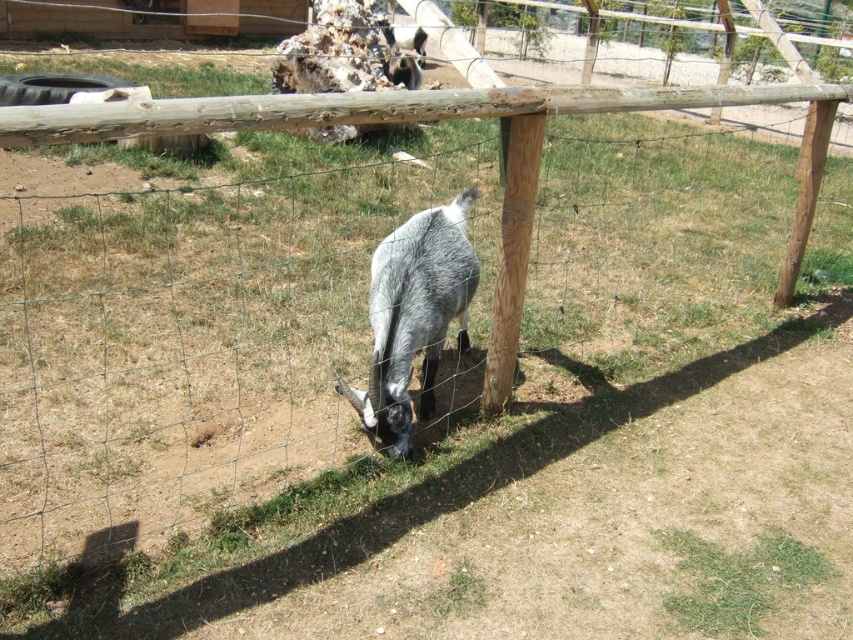
Based on the photo, does gray woolen goat at center appear under fuzzy gray goat at center?

Yes, gray woolen goat at center is below fuzzy gray goat at center.

Is gray woolen goat at center to the right of fuzzy gray goat at center from the viewer's perspective?

Indeed, gray woolen goat at center is positioned on the right side of fuzzy gray goat at center.

This screenshot has width=853, height=640. Describe the element at coordinates (413, 316) in the screenshot. I see `gray woolen goat at center` at that location.

I want to click on gray woolen goat at center, so click(413, 316).

Which of these two, gray woolen goat at center or brown rough wooden post at center, stands taller?

brown rough wooden post at center

Can you confirm if gray woolen goat at center is taller than brown rough wooden post at center?

Incorrect, gray woolen goat at center's height is not larger of brown rough wooden post at center's.

Which is in front, point (413, 284) or point (515, 120)?

Point (515, 120) is more forward.

The width and height of the screenshot is (853, 640). I want to click on gray woolen goat at center, so click(x=413, y=316).

Can you confirm if brown rough wooden post at center is positioned to the left of fuzzy gray goat at center?

In fact, brown rough wooden post at center is to the right of fuzzy gray goat at center.

Between brown rough wooden post at center and fuzzy gray goat at center, which one has less height?

fuzzy gray goat at center is shorter.

Does point (538, 136) come farther from viewer compared to point (386, 29)?

No.

Locate an element on the screen. The image size is (853, 640). brown rough wooden post at center is located at coordinates [512, 256].